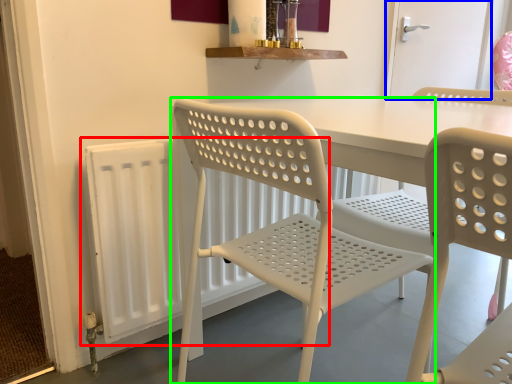
Question: Which is nearer to the radiator (highlighted by a red box)? screen door (highlighted by a blue box) or chair (highlighted by a green box).

Choices:
 (A) screen door
 (B) chair

Answer: (B)